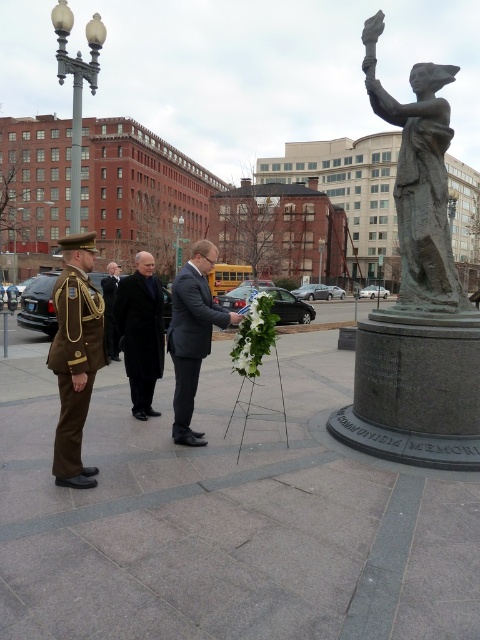
Question: Is dark gray wool coat at center bigger than dark brown uniform at left?

Choices:
 (A) no
 (B) yes

Answer: (A)

Question: Does bronze statue at right have a larger size compared to dark gray wool coat at center?

Choices:
 (A) no
 (B) yes

Answer: (B)

Question: Which of the following is the farthest from the observer?

Choices:
 (A) dark brown uniform at left
 (B) brown fabric uniform at left
 (C) matte black suit at center

Answer: (C)

Question: Where is matte black suit at center located in relation to dark brown uniform at left in the image?

Choices:
 (A) below
 (B) above

Answer: (B)

Question: Based on their relative distances, which object is farther from the matte black suit at center?

Choices:
 (A) dark brown uniform at left
 (B) dark gray wool coat at center

Answer: (A)

Question: Which point is closer to the camera taking this photo?

Choices:
 (A) (432, 250)
 (B) (104, 284)
 (C) (192, 285)

Answer: (C)